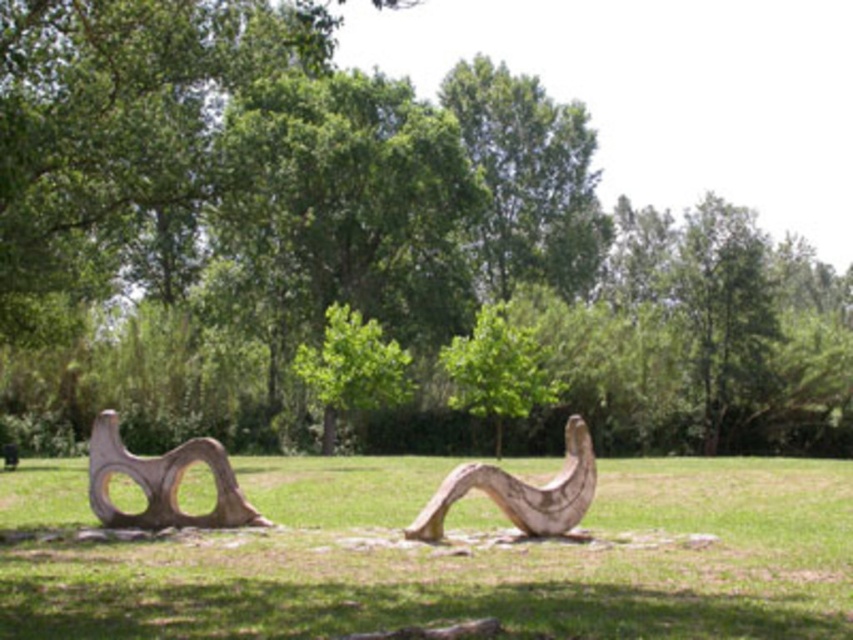
Question: Estimate the real-world distances between objects in this image. Which object is closer to the green wood tree at center?

Choices:
 (A) green grass at center
 (B) green leafy tree at center
 (C) natural wood sculpture at left
 (D) natural wood sculpture at center

Answer: (B)

Question: Does green leafy tree at center appear under natural wood sculpture at center?

Choices:
 (A) yes
 (B) no

Answer: (B)

Question: Can you confirm if green wood tree at center is thinner than green leafy tree at center?

Choices:
 (A) no
 (B) yes

Answer: (A)

Question: Among these objects, which one is farthest from the camera?

Choices:
 (A) green wood tree at center
 (B) natural wood sculpture at center
 (C) green leafy tree at center
 (D) green grass at center

Answer: (C)

Question: Which point appears farthest from the camera in this image?

Choices:
 (A) (383, 365)
 (B) (267, 184)
 (C) (717, 483)
 (D) (196, 460)

Answer: (A)

Question: Is green grass at center closer to the viewer compared to natural wood sculpture at center?

Choices:
 (A) yes
 (B) no

Answer: (A)